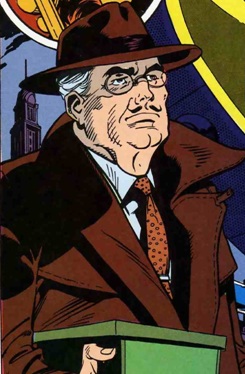
I want to click on coat, so click(102, 249).